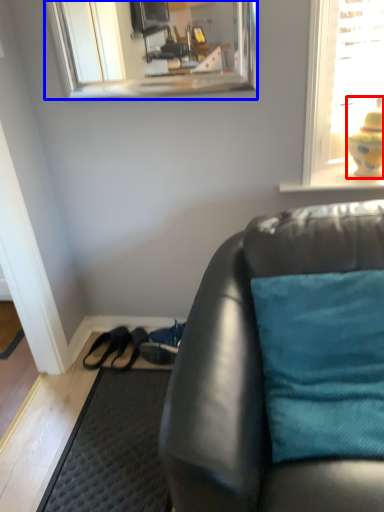
Question: Which object appears farthest to the camera in this image, toy (highlighted by a red box) or mirror (highlighted by a blue box)?

Choices:
 (A) toy
 (B) mirror

Answer: (A)